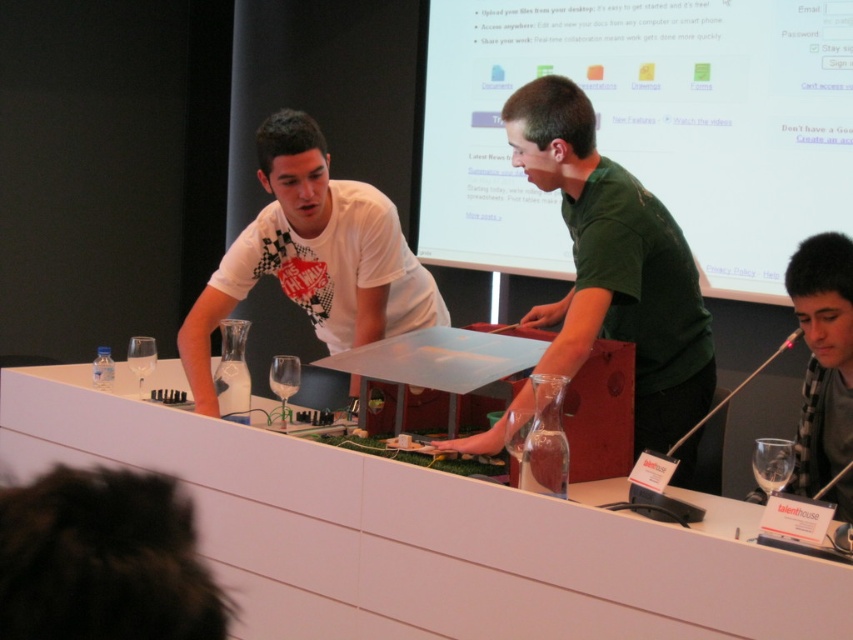
Is white glossy table at center thinner than white glossy projection screen at upper center?

No.

Who is more distant from viewer, (422,618) or (657,136)?

Positioned behind is point (657,136).

What are the coordinates of `white glossy table at center` in the screenshot? It's located at (424, 536).

Between white matte shirt at center and clear glass wine glass at left, which one is positioned lower?

clear glass wine glass at left is below.

Is point (369, 225) in front of point (142, 349)?

Yes, point (369, 225) is in front of point (142, 349).

This screenshot has height=640, width=853. I want to click on white matte shirt at center, so click(312, 257).

Which is below, white glossy projection screen at upper center or clear glass wine glass at left?

clear glass wine glass at left is lower down.

At what (x,y) coordinates should I click in order to perform the action: click on white glossy projection screen at upper center. Please return your answer as a coordinate pair (x, y). Looking at the image, I should click on (645, 125).

This screenshot has width=853, height=640. I want to click on white glossy projection screen at upper center, so click(645, 125).